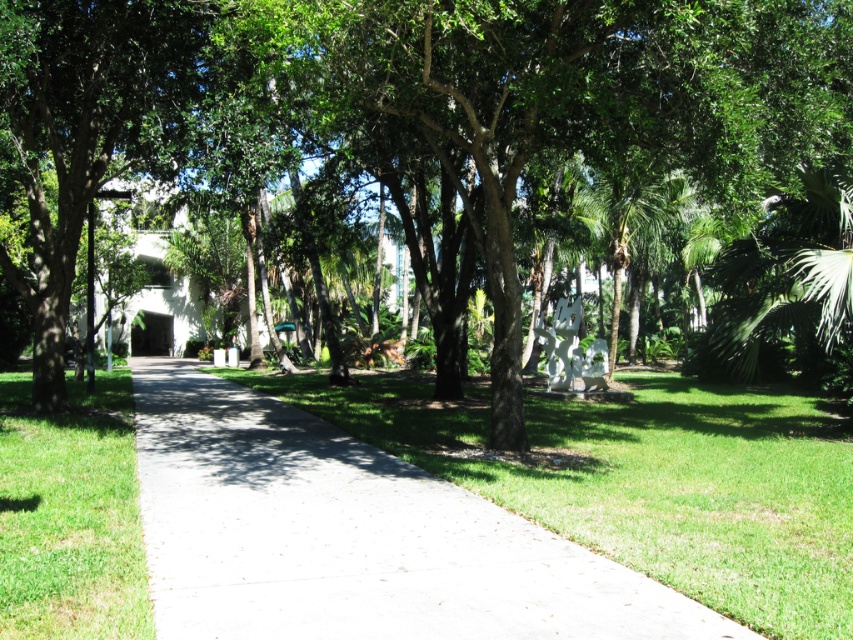
Is green leafy tree at center to the left of white concrete pavement at center from the viewer's perspective?

Incorrect, green leafy tree at center is not on the left side of white concrete pavement at center.

Measure the distance between point (396,124) and camera.

Point (396,124) is 49.83 feet from camera.

You are a GUI agent. You are given a task and a screenshot of the screen. Output one action in this format:
    pyautogui.click(x=<x>, y=<y>)
    Task: Click on the green leafy tree at center
    
    Given the screenshot: What is the action you would take?
    pyautogui.click(x=456, y=148)

Identify the location of green leafy tree at center. The width and height of the screenshot is (853, 640). (456, 148).

How distant is white concrete pavement at center from green grass at lower left?

The distance of white concrete pavement at center from green grass at lower left is 1.69 meters.

Between white concrete pavement at center and green grass at lower left, which one appears on the right side from the viewer's perspective?

Positioned to the right is white concrete pavement at center.

Does point (447, 596) come farther from viewer compared to point (32, 497)?

No.

This screenshot has width=853, height=640. Identify the location of white concrete pavement at center. (352, 536).

Based on the photo, does green leafy tree at center have a lesser height compared to green grass at lower left?

No.

Who is more distant from viewer, [402,138] or [12,387]?

Positioned behind is point [12,387].

Who is more distant from viewer, (735, 188) or (109, 566)?

The point (735, 188) is behind.

You are a GUI agent. You are given a task and a screenshot of the screen. Output one action in this format:
    pyautogui.click(x=<x>, y=<y>)
    Task: Click on the green leafy tree at center
    The height and width of the screenshot is (640, 853).
    Given the screenshot: What is the action you would take?
    pyautogui.click(x=456, y=148)